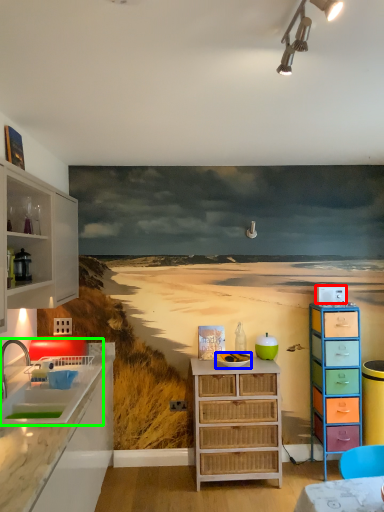
Question: Which object is positioned farthest from appliance (highlighted by a red box)? Select from appliance (highlighted by a blue box) and sink (highlighted by a green box).

Choices:
 (A) appliance
 (B) sink

Answer: (B)